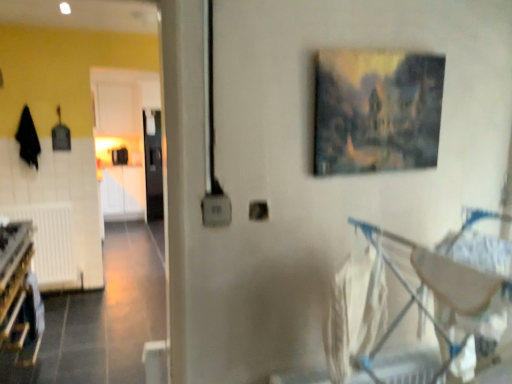
Question: Can you confirm if wooden bunk bed at lower left is smaller than oil painting at upper center?

Choices:
 (A) no
 (B) yes

Answer: (A)

Question: Can you confirm if wooden bunk bed at lower left is wider than oil painting at upper center?

Choices:
 (A) no
 (B) yes

Answer: (B)

Question: Can you confirm if wooden bunk bed at lower left is bigger than oil painting at upper center?

Choices:
 (A) yes
 (B) no

Answer: (A)

Question: Does wooden bunk bed at lower left appear on the right side of oil painting at upper center?

Choices:
 (A) no
 (B) yes

Answer: (A)

Question: Does wooden bunk bed at lower left have a greater height compared to oil painting at upper center?

Choices:
 (A) no
 (B) yes

Answer: (A)

Question: From the image's perspective, is oil painting at upper center above or below white fabric laundry at lower right?

Choices:
 (A) above
 (B) below

Answer: (A)

Question: Is oil painting at upper center bigger or smaller than white fabric laundry at lower right?

Choices:
 (A) small
 (B) big

Answer: (A)

Question: Considering the positions of oil painting at upper center and white fabric laundry at lower right in the image, is oil painting at upper center taller or shorter than white fabric laundry at lower right?

Choices:
 (A) tall
 (B) short

Answer: (B)

Question: Is oil painting at upper center in front of or behind white fabric laundry at lower right in the image?

Choices:
 (A) front
 (B) behind

Answer: (B)

Question: Considering the positions of white fabric laundry at lower right and oil painting at upper center in the image, is white fabric laundry at lower right bigger or smaller than oil painting at upper center?

Choices:
 (A) big
 (B) small

Answer: (A)

Question: From their relative heights in the image, would you say white fabric laundry at lower right is taller or shorter than oil painting at upper center?

Choices:
 (A) short
 (B) tall

Answer: (B)

Question: Is white fabric laundry at lower right wider or thinner than oil painting at upper center?

Choices:
 (A) wide
 (B) thin

Answer: (A)

Question: From a real-world perspective, is white fabric laundry at lower right above or below oil painting at upper center?

Choices:
 (A) above
 (B) below

Answer: (B)

Question: Looking at their shapes, would you say metallic silver baby carriage at lower right is wider or thinner than white fabric laundry at lower right?

Choices:
 (A) wide
 (B) thin

Answer: (A)

Question: From the image's perspective, is metallic silver baby carriage at lower right positioned above or below white fabric laundry at lower right?

Choices:
 (A) above
 (B) below

Answer: (B)